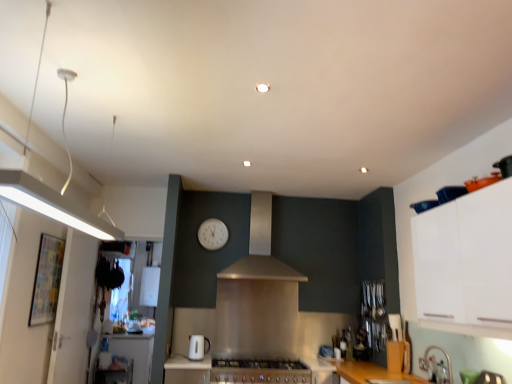
What is the approximate height of white glossy toaster at lower center?

The height of white glossy toaster at lower center is 21.99 centimeters.

What are the coordinates of `white glossy toaster at lower center` in the screenshot? It's located at (198, 347).

Find the location of a particular element. Image resolution: width=512 pixels, height=384 pixels. white plastic clock at center is located at coordinates (213, 234).

Considering the relative positions of white plastic clock at center and white glossy toaster at lower center in the image provided, is white plastic clock at center to the left or to the right of white glossy toaster at lower center?

In the image, white plastic clock at center appears on the right side of white glossy toaster at lower center.

Is white plastic clock at center positioned with its back to white glossy toaster at lower center?

That's not correct — white plastic clock at center is not looking away from white glossy toaster at lower center.

The image size is (512, 384). Identify the location of clock on the right of white glossy toaster at lower center. (213, 234).

Based on the photo, from a real-world perspective, relative to white glossy toaster at lower center, is white plastic clock at center vertically above or below?

Clearly, from a real-world perspective, white plastic clock at center is above white glossy toaster at lower center.

From the picture: Is white plastic clock at center at the back of metallic stainless steel countertop at lower center?

No, metallic stainless steel countertop at lower center's orientation is not away from white plastic clock at center.

Is metallic stainless steel countertop at lower center further to the viewer compared to white plastic clock at center?

No, metallic stainless steel countertop at lower center is in front of white plastic clock at center.

Based on the photo, which point is more forward, (181, 357) or (210, 242)?

The point (181, 357) is closer to the camera.

Consider the image. Considering the sizes of metallic stainless steel countertop at lower center and white plastic clock at center in the image, is metallic stainless steel countertop at lower center taller or shorter than white plastic clock at center?

In the image, metallic stainless steel countertop at lower center appears to be shorter than white plastic clock at center.

From the image's perspective, who appears lower, white glossy toaster at lower center or metallic stainless steel countertop at lower center?

metallic stainless steel countertop at lower center appears lower in the image.

Can you confirm if white glossy toaster at lower center is bigger than metallic stainless steel countertop at lower center?

Actually, white glossy toaster at lower center might be smaller than metallic stainless steel countertop at lower center.

Based on the photo, considering the sizes of objects white glossy toaster at lower center and metallic stainless steel countertop at lower center in the image provided, who is shorter, white glossy toaster at lower center or metallic stainless steel countertop at lower center?

With less height is metallic stainless steel countertop at lower center.

Is metallic stainless steel countertop at lower center inside white glossy toaster at lower center?

No, metallic stainless steel countertop at lower center is not surrounded by white glossy toaster at lower center.

In terms of size, does satin silver hood at center appear bigger or smaller than white matte cabinet at upper right?

In the image, satin silver hood at center appears to be larger than white matte cabinet at upper right.

Is white matte cabinet at upper right inside satin silver hood at center?

Actually, white matte cabinet at upper right is outside satin silver hood at center.

Between satin silver hood at center and white matte cabinet at upper right, which one has less height?

With less height is white matte cabinet at upper right.

Does metallic stainless steel countertop at lower center have a smaller size compared to white glossy toaster at lower center?

No, metallic stainless steel countertop at lower center is not smaller than white glossy toaster at lower center.

What's the angular difference between metallic stainless steel countertop at lower center and white glossy toaster at lower center's facing directions?

0.795 degrees.

From the image's perspective, is metallic stainless steel countertop at lower center under white glossy toaster at lower center?

Yes, from the image's perspective, metallic stainless steel countertop at lower center is beneath white glossy toaster at lower center.

Are metallic stainless steel countertop at lower center and white glossy toaster at lower center located far from each other?

Actually, metallic stainless steel countertop at lower center and white glossy toaster at lower center are a little close together.

Which is behind, point (492, 229) or point (280, 275)?

Point (280, 275)

Is white matte cabinet at upper right further to camera compared to satin silver hood at center?

No, it is in front of satin silver hood at center.

Would you consider white matte cabinet at upper right to be distant from satin silver hood at center?

white matte cabinet at upper right is positioned a significant distance from satin silver hood at center.

Which of these two, white matte cabinet at upper right or satin silver hood at center, is bigger?

With larger size is satin silver hood at center.

Does white glossy counter top at lower left have a greater height compared to satin silver hood at center?

No.

Between white glossy counter top at lower left and satin silver hood at center, which one appears on the right side from the viewer's perspective?

From the viewer's perspective, satin silver hood at center appears more on the right side.

This screenshot has width=512, height=384. I want to click on hood in front of the white glossy counter top at lower left, so [x=261, y=248].

Which of these two, white glossy counter top at lower left or satin silver hood at center, is wider?

white glossy counter top at lower left is wider.

You are a GUI agent. You are given a task and a screenshot of the screen. Output one action in this format:
    pyautogui.click(x=<x>, y=<y>)
    Task: Click on the clock lying above the white glossy toaster at lower center (from the image's perspective)
    Image resolution: width=512 pixels, height=384 pixels.
    Given the screenshot: What is the action you would take?
    pyautogui.click(x=213, y=234)

Locate an element on the screen. This screenshot has width=512, height=384. countertop that appears in front of the white plastic clock at center is located at coordinates (241, 373).

Estimate the real-world distances between objects in this image. Which object is further from white plastic clock at center, metallic stainless steel countertop at lower center or satin silver hood at center?

Among the two, metallic stainless steel countertop at lower center is located further to white plastic clock at center.

Looking at the image, which one is located further to white matte cabinet at upper right, metallic stainless steel countertop at lower center or white glossy toaster at lower center?

white glossy toaster at lower center is positioned further to the anchor white matte cabinet at upper right.

Looking at the image, which one is located closer to metallic stainless steel countertop at lower center, satin silver hood at center or white glossy counter top at lower left?

white glossy counter top at lower left lies closer to metallic stainless steel countertop at lower center than the other object.

Looking at the image, which one is located further to metallic stainless steel countertop at lower center, white glossy counter top at lower left or white glossy toaster at lower center?

The object further to metallic stainless steel countertop at lower center is white glossy counter top at lower left.

Considering their positions, is white glossy counter top at lower left positioned closer to white plastic clock at center than white glossy toaster at lower center?

Based on the image, white glossy toaster at lower center appears to be nearer to white plastic clock at center.

Estimate the real-world distances between objects in this image. Which object is closer to metallic stainless steel countertop at lower center, white matte cabinet at upper right or white plastic clock at center?

Among the two, white plastic clock at center is located nearer to metallic stainless steel countertop at lower center.

Which object lies further to the anchor point white glossy toaster at lower center, white matte cabinet at upper right or white plastic clock at center?

white matte cabinet at upper right lies further to white glossy toaster at lower center than the other object.

Looking at this image, looking at the image, which one is located further to white matte cabinet at upper right, satin silver hood at center or white glossy toaster at lower center?

white glossy toaster at lower center.

You are a GUI agent. You are given a task and a screenshot of the screen. Output one action in this format:
    pyautogui.click(x=<x>, y=<y>)
    Task: Click on the kitchen appliance between white matte cabinet at upper right and satin silver hood at center along the z-axis
    This screenshot has height=384, width=512.
    Given the screenshot: What is the action you would take?
    pyautogui.click(x=198, y=347)

This screenshot has width=512, height=384. Find the location of `countertop situated between white glossy counter top at lower left and satin silver hood at center from left to right`. countertop situated between white glossy counter top at lower left and satin silver hood at center from left to right is located at coordinates 241,373.

At what (x,y) coordinates should I click in order to perform the action: click on hood located between white matte cabinet at upper right and white plastic clock at center in the depth direction. Please return your answer as a coordinate pair (x, y). This screenshot has width=512, height=384. Looking at the image, I should click on (261, 248).

The height and width of the screenshot is (384, 512). I want to click on kitchen appliance located between white matte cabinet at upper right and white plastic clock at center in the depth direction, so click(x=198, y=347).